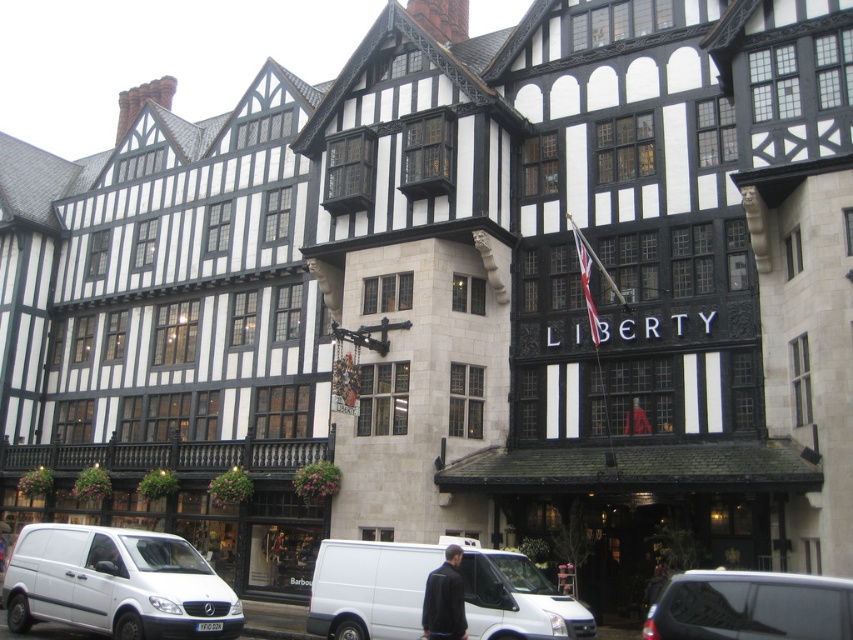
You are a delivery driver who needs to park your white matte van at lower left in a spot that is 0.9 meters wide. The parking spot is at coordinates point [115,582]. Can your van fit into this parking spot?

The point [115,582] indicates the location of the white matte van at lower left. Since the parking spot is exactly at that coordinate and the van is 0.9 meters wide, it should fit as long as the spot is at least that width. However, the description does not provide the spot width, so we cannot confirm.

You are a delivery person who needs to park your vehicle in a tight space near the building. You have two vans available, a white matte van at lower left and a metallic silver van at center. Which van would be more suitable for the tight space based on their sizes?

The metallic silver van at center is more suitable for the tight space because it is smaller in size compared to the white matte van at lower left.

You are a delivery person driving a white matte van at center. You need to park your van in a parking spot that can only accommodate vehicles narrower than the dark blue jacket at center. Can your van fit in the spot?

The white matte van at center is wider than the dark blue jacket at center, so it cannot fit in the parking spot designed for narrower vehicles.